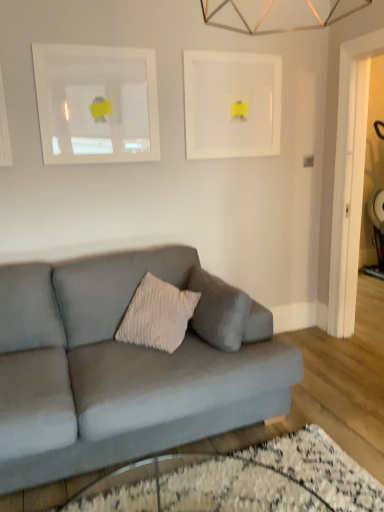
Question: Would you say white matte picture frame at upper left, which ranks as the first picture frame in left-to-right order, is inside or outside white matte picture frame at upper center, the 1th picture frame viewed from the right?

Choices:
 (A) outside
 (B) inside

Answer: (A)

Question: Does point (107, 158) appear closer or farther from the camera than point (246, 111)?

Choices:
 (A) farther
 (B) closer

Answer: (B)

Question: Based on their relative distances, which object is nearer to the transparent glass table at lower center?

Choices:
 (A) matte gray couch at center
 (B) white matte picture frame at upper left, which is the second picture frame from right to left
 (C) white matte picture frame at upper center, which is the second picture frame from left to right

Answer: (A)

Question: Which object is the closest to the white matte picture frame at upper left, which is the second picture frame from right to left?

Choices:
 (A) white matte picture frame at upper center, the 1th picture frame viewed from the right
 (B) transparent glass table at lower center
 (C) matte gray couch at center

Answer: (A)